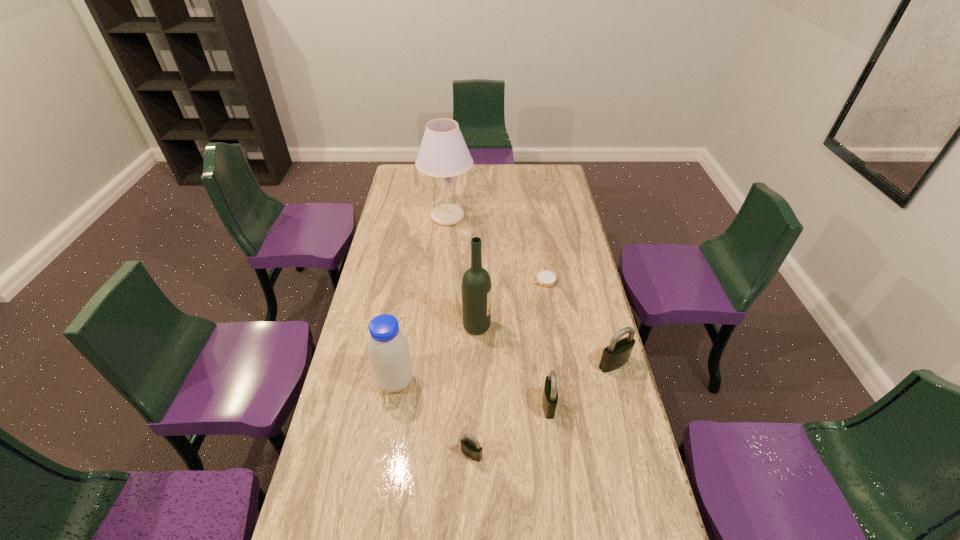
You are a GUI agent. You are given a task and a screenshot of the screen. Output one action in this format:
    pyautogui.click(x=<x>, y=<y>)
    Task: Click on the shortest object
    This screenshot has height=540, width=960.
    Given the screenshot: What is the action you would take?
    pyautogui.click(x=545, y=278)

I want to click on vacant space situated 0.270m on the back of the second shortest object, so click(x=473, y=368).

Locate an element on the screen. free space located on the right of the second shortest padlock is located at coordinates click(585, 405).

Locate an element on the screen. This screenshot has width=960, height=540. free spot located on the front of the farthest padlock is located at coordinates (621, 392).

Locate an element on the screen. vacant region located on the front of the farthest object is located at coordinates (444, 246).

Where is `vacant space located on the back of the soya milk`? vacant space located on the back of the soya milk is located at coordinates (404, 327).

You are a GUI agent. You are given a task and a screenshot of the screen. Output one action in this format:
    pyautogui.click(x=<x>, y=<y>)
    Task: Click on the vacant space located 0.300m on the labeled side of the third farthest object
    Image resolution: width=960 pixels, height=540 pixels.
    Given the screenshot: What is the action you would take?
    pyautogui.click(x=574, y=326)

I want to click on free spot located 0.310m on the left of the compass, so click(x=452, y=280).

The height and width of the screenshot is (540, 960). I want to click on object present at the left edge, so click(388, 348).

Where is `padlock that is at the right edge`? This screenshot has width=960, height=540. padlock that is at the right edge is located at coordinates (617, 353).